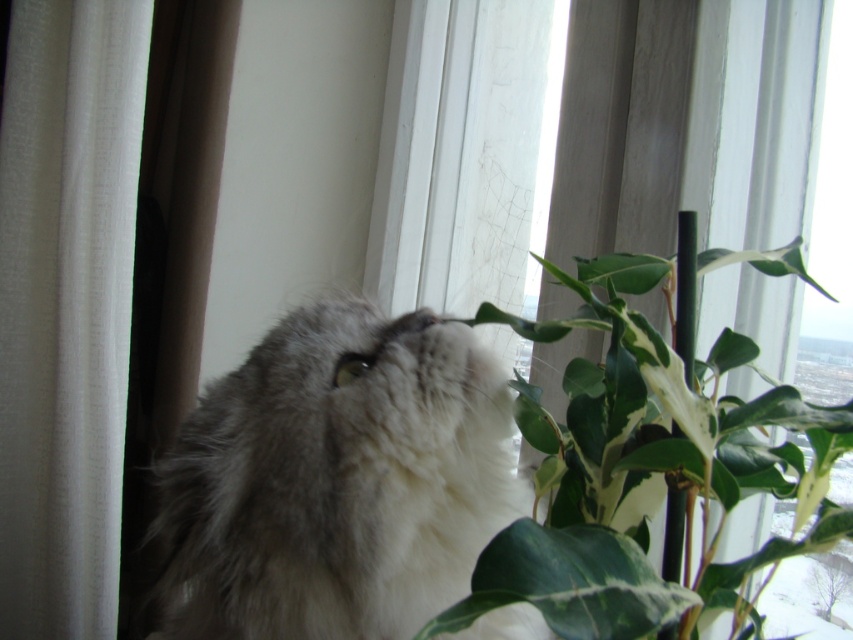
In the scene shown: You are a cat owner who wants to ensure your cat stays safe. The cat is near the window where the white sheer curtain at left and the green leafy plant at center are located. Based on their positions, which object is closer to the window?

The green leafy plant at center is behind the white sheer curtain at left, so the white sheer curtain at left is closer to the window than the green leafy plant at center.

You are a photographer trying to capture a clear photo of the green leafy plant at center. However, the fuzzy fur cat at center is blocking your view. Can you move the cat to the side so that the plant is visible without obstruction?

The green leafy plant at center is behind the fuzzy fur cat at center, so moving the cat to the side would allow the plant to be visible without obstruction.

You are a photographer standing at the point marked as point [123,440]. You want to take a photo of the cat and the plant. The camera you are using has a focal length of 50mm. To ensure both the cat and the plant are in focus, what should be the minimum distance you need to set the focus at?

The minimum focus distance should be set to 1.31 meters because the point marked as point [123,440] and the camera are 1.31 meters apart from each other.